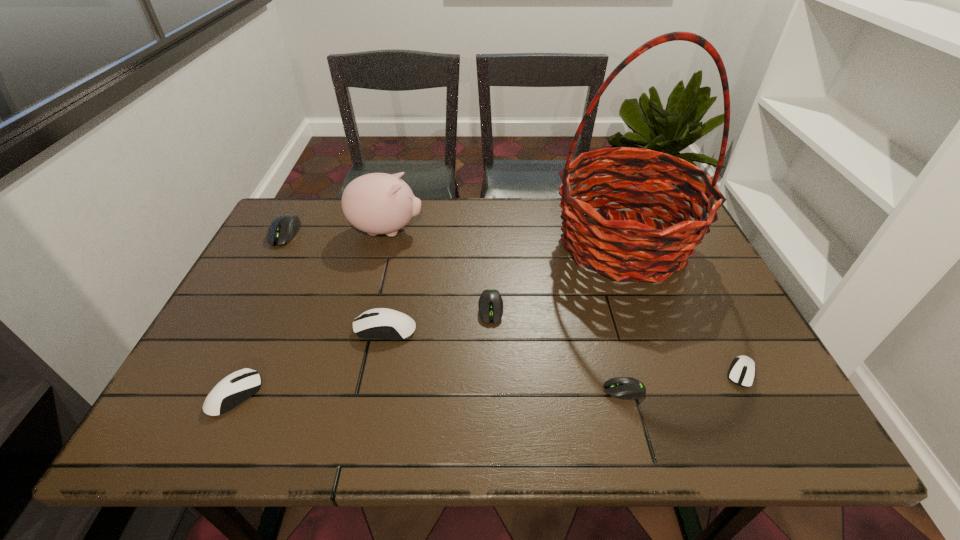
In order to click on basket in this screenshot , I will do `click(654, 251)`.

The height and width of the screenshot is (540, 960). I want to click on piggy bank, so click(x=377, y=203).

In order to click on the second white mouse from right to left in this screenshot , I will do `click(381, 323)`.

This screenshot has height=540, width=960. I want to click on the farthest white mouse, so click(381, 323).

This screenshot has height=540, width=960. What are the coordinates of `the farthest computer mouse` in the screenshot? It's located at (283, 229).

Find the location of a particular element. the biggest gray computer mouse is located at coordinates (283, 229).

The image size is (960, 540). What are the coordinates of `the leftmost white mouse` in the screenshot? It's located at (235, 388).

The height and width of the screenshot is (540, 960). Identify the location of the second gray computer mouse from left to right. (490, 304).

You are a GUI agent. You are given a task and a screenshot of the screen. Output one action in this format:
    pyautogui.click(x=<x>, y=<y>)
    Task: Click on the fourth object from right to left
    The image size is (960, 540).
    Given the screenshot: What is the action you would take?
    point(490,304)

Locate an element on the screen. Image resolution: width=960 pixels, height=540 pixels. the rightmost white mouse is located at coordinates (742, 371).